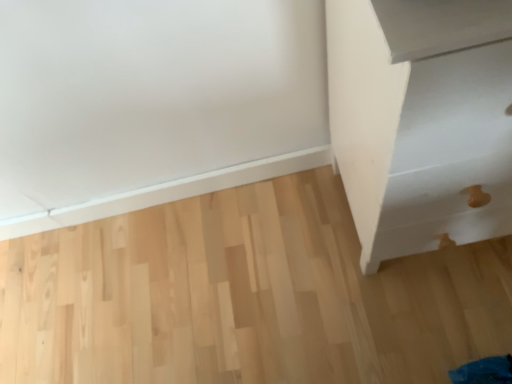
Question: From a real-world perspective, relative to natural wood floor at center, is white matte drawer at right vertically above or below?

Choices:
 (A) above
 (B) below

Answer: (A)

Question: In the image, is white matte drawer at right on the left side or the right side of natural wood floor at center?

Choices:
 (A) left
 (B) right

Answer: (B)

Question: Is white matte drawer at right bigger or smaller than natural wood floor at center?

Choices:
 (A) small
 (B) big

Answer: (B)

Question: In the image, is natural wood floor at center positioned in front of or behind white matte drawer at right?

Choices:
 (A) front
 (B) behind

Answer: (B)

Question: Looking at their shapes, would you say natural wood floor at center is wider or thinner than white matte drawer at right?

Choices:
 (A) wide
 (B) thin

Answer: (A)

Question: Considering the positions of natural wood floor at center and white matte drawer at right in the image, is natural wood floor at center taller or shorter than white matte drawer at right?

Choices:
 (A) short
 (B) tall

Answer: (A)

Question: Based on their sizes in the image, would you say natural wood floor at center is bigger or smaller than white matte drawer at right?

Choices:
 (A) small
 (B) big

Answer: (A)